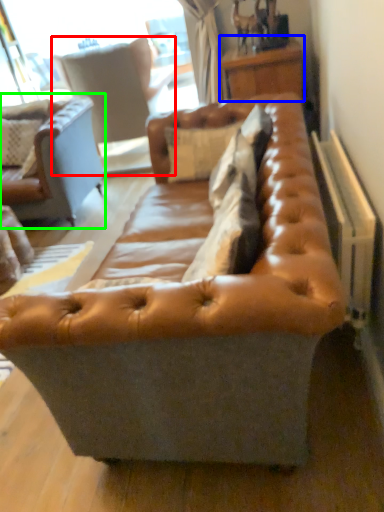
Question: Based on their relative distances, which object is farther from swivel chair (highlighted by a red box)? Choose from table (highlighted by a blue box) and studio couch (highlighted by a green box).

Choices:
 (A) table
 (B) studio couch

Answer: (A)